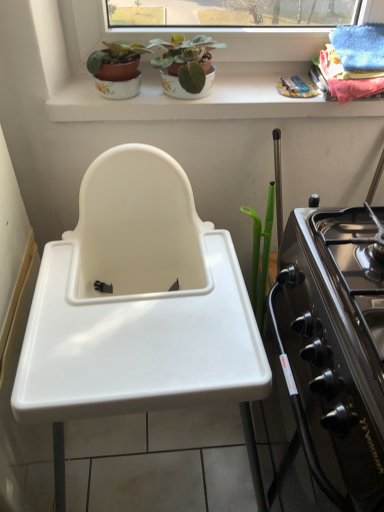
The height and width of the screenshot is (512, 384). What are the coordinates of `vacant point to the right of matte ceramic pot at upper center, the 2th houseplant viewed from the left` in the screenshot? It's located at (243, 82).